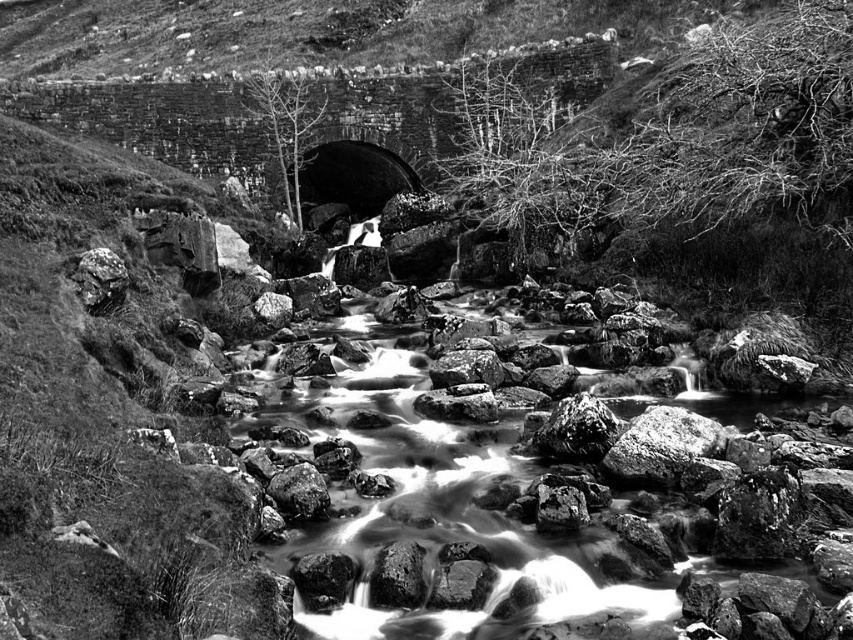
Question: Can you confirm if rough textured rock at upper left is bigger than rough textured rock at center?

Choices:
 (A) no
 (B) yes

Answer: (A)

Question: Among these points, which one is nearest to the camera?

Choices:
 (A) (83, 266)
 (B) (294, 516)

Answer: (B)

Question: Is rough textured rock at upper left positioned behind rough textured rock at center?

Choices:
 (A) yes
 (B) no

Answer: (A)

Question: Is rough textured rock at upper left positioned before rough textured rock at center?

Choices:
 (A) yes
 (B) no

Answer: (B)

Question: Which object appears closest to the camera in this image?

Choices:
 (A) rough textured rock at center
 (B) rough textured rock at upper left

Answer: (A)

Question: Which of the following is the closest to the observer?

Choices:
 (A) rough textured rock at upper left
 (B) rough textured rock at center

Answer: (B)